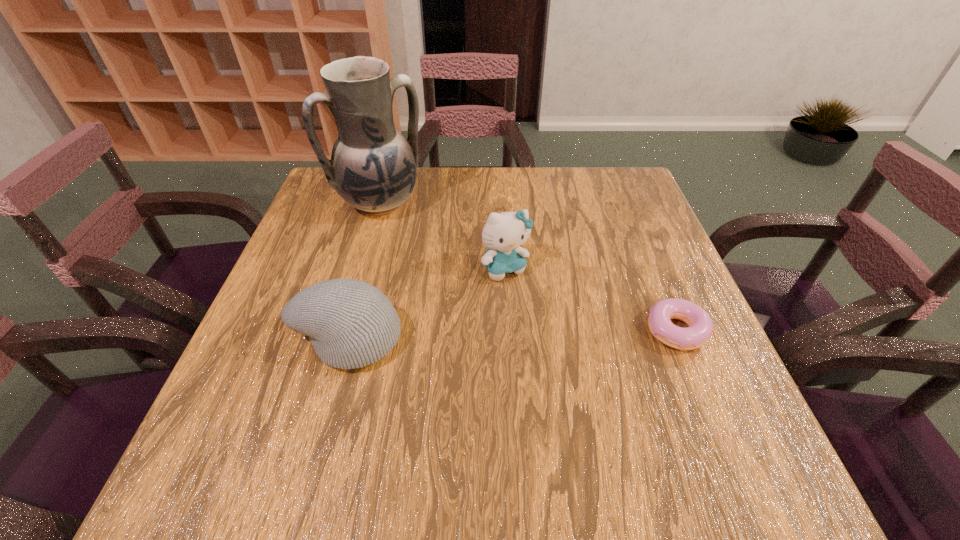
You are a GUI agent. You are given a task and a screenshot of the screen. Output one action in this format:
    pyautogui.click(x=<x>, y=<y>)
    Task: Click on the vacant space situated 0.150m on the front-facing side of the pitcher
    The width and height of the screenshot is (960, 540).
    Given the screenshot: What is the action you would take?
    tap(424, 256)

Where is `free point located 0.270m on the front-facing side of the pitcher`? The height and width of the screenshot is (540, 960). free point located 0.270m on the front-facing side of the pitcher is located at coordinates (448, 287).

Identify the location of blank space located on the face of the third object from left to right. (570, 377).

You are a GUI agent. You are given a task and a screenshot of the screen. Output one action in this format:
    pyautogui.click(x=<x>, y=<y>)
    Task: Click on the free space located 0.230m on the face of the third object from left to right
    The width and height of the screenshot is (960, 540).
    Given the screenshot: What is the action you would take?
    pyautogui.click(x=563, y=365)

The image size is (960, 540). I want to click on free space located 0.260m on the face of the third object from left to right, so click(x=570, y=377).

Find the location of `object that is at the far edge`. object that is at the far edge is located at coordinates (373, 167).

The width and height of the screenshot is (960, 540). In order to click on beanie that is at the left edge in this screenshot , I will do `click(351, 324)`.

At what (x,y) coordinates should I click in order to perform the action: click on pitcher at the left edge. Please return your answer as a coordinate pair (x, y). The image size is (960, 540). Looking at the image, I should click on (373, 167).

What are the coordinates of `object located in the right edge section of the desktop` in the screenshot? It's located at (700, 328).

Image resolution: width=960 pixels, height=540 pixels. In order to click on object located at the far left corner in this screenshot , I will do `click(373, 167)`.